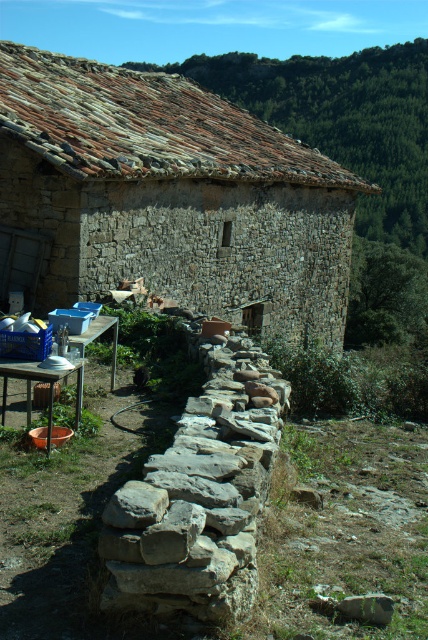
Question: Estimate the real-world distances between objects in this image. Which object is closer to the rustic stone hut at upper left?

Choices:
 (A) gray rough stone at lower center
 (B) rustic stone roof at upper center

Answer: (A)

Question: Can you confirm if rustic stone roof at upper center is positioned below gray rough stone at lower center?

Choices:
 (A) yes
 (B) no

Answer: (B)

Question: Based on their relative distances, which object is nearer to the rustic stone hut at upper left?

Choices:
 (A) rustic stone roof at upper center
 (B) gray rough stone at lower center
 (C) natural stone wall at center
 (D) metallic silver picnic table at lower left

Answer: (C)

Question: Where is natural stone wall at center located in relation to rustic stone roof at upper center in the image?

Choices:
 (A) left
 (B) right

Answer: (A)

Question: Which point is closer to the camera?

Choices:
 (A) (365, 609)
 (B) (359, 157)
 (C) (27, 384)
 (D) (225, 365)

Answer: (A)

Question: Does natural stone wall at center appear on the left side of rustic stone roof at upper center?

Choices:
 (A) no
 (B) yes

Answer: (B)